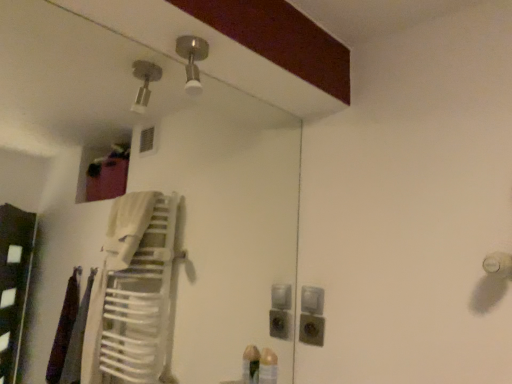
Question: From the image's perspective, is matte gray outlet at lower center above or below satin nickel light fixture at upper center?

Choices:
 (A) above
 (B) below

Answer: (B)

Question: From a real-world perspective, is matte gray outlet at lower center above or below satin nickel light fixture at upper center?

Choices:
 (A) below
 (B) above

Answer: (A)

Question: Considering the real-world distances, which object is closest to the matte gray outlet at lower center?

Choices:
 (A) satin silver switch at center
 (B) satin nickel light fixture at upper center

Answer: (A)

Question: Which object is the closest to the satin nickel light fixture at upper center?

Choices:
 (A) satin silver switch at center
 (B) matte gray outlet at lower center

Answer: (A)